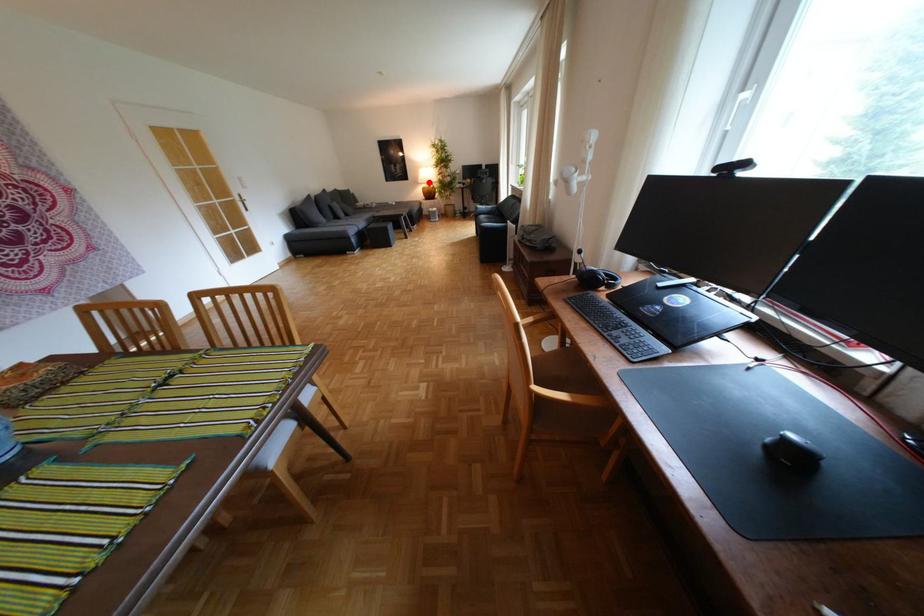
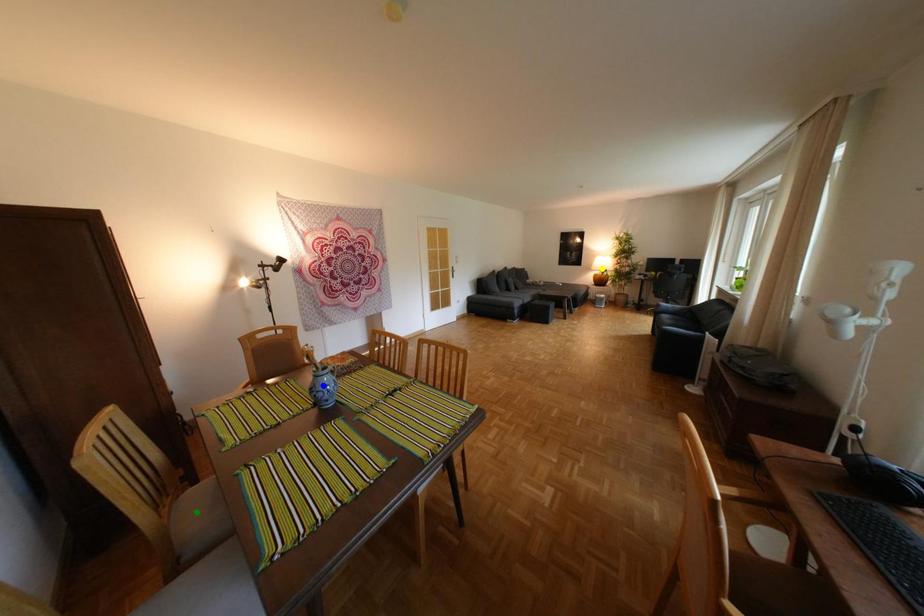
Question: I am providing you with two images of the same scene from different viewpoints. A red point is marked on the first image. You are given multiple points on the second image. Which spot in image 2 lines up with the point in image 1?

Choices:
 (A) blue point
 (B) green point
 (C) yellow point

Answer: (C)